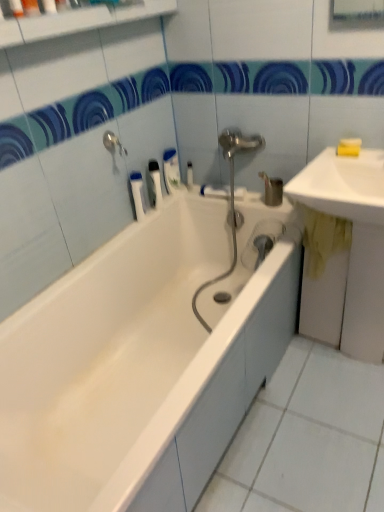
What are the coordinates of `free space to the left of yellow matte soap at upper right, which is counted as the first soap, starting from the bottom` in the screenshot? It's located at (327, 158).